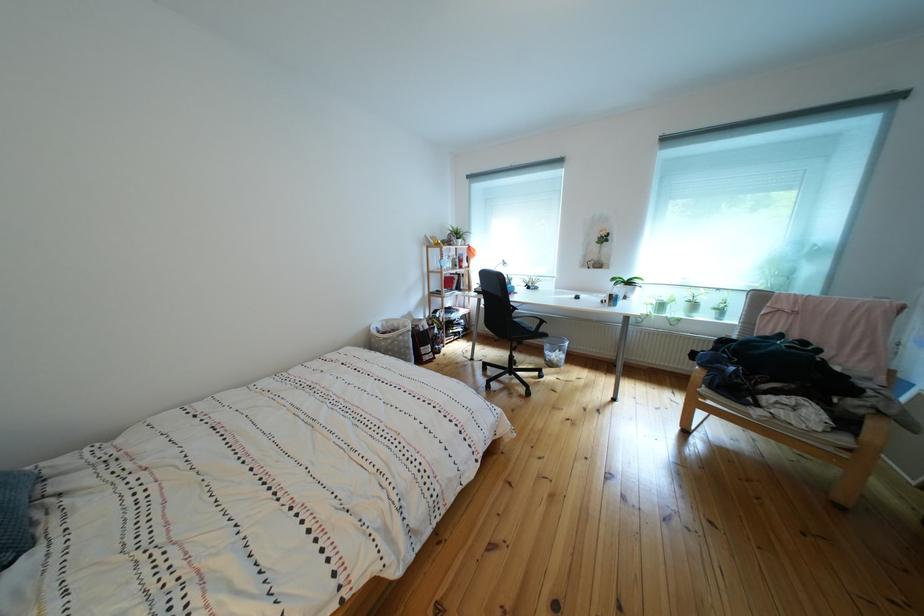
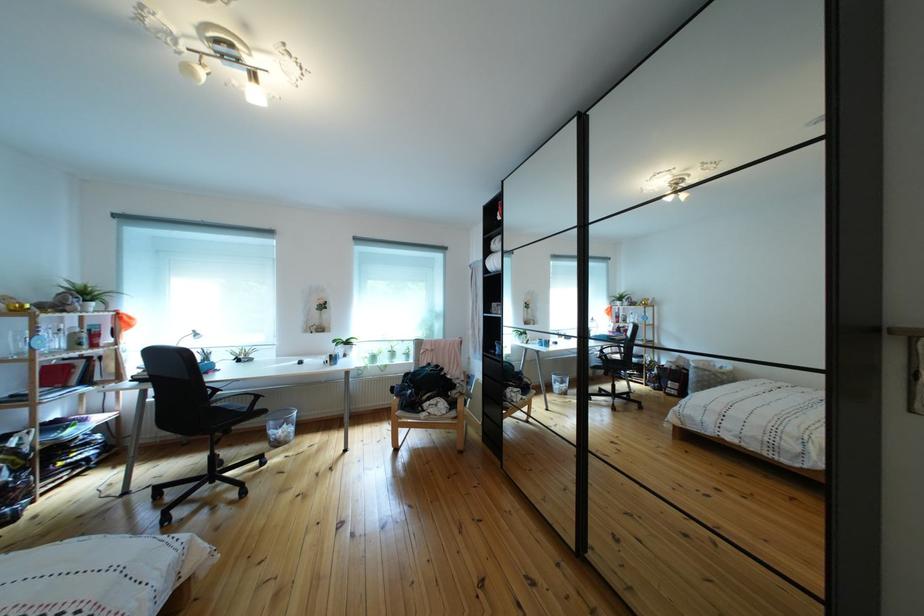
In the second image, find the point that corresponds to pixel 558 352 in the first image.

(283, 430)